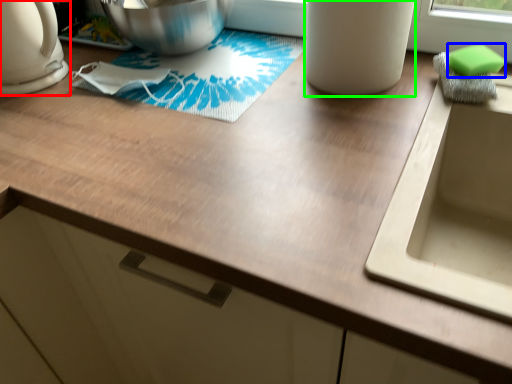
Question: Which is nearer to the kitchen appliance (highlighted by a red box)? soap (highlighted by a blue box) or appliance (highlighted by a green box).

Choices:
 (A) soap
 (B) appliance

Answer: (B)